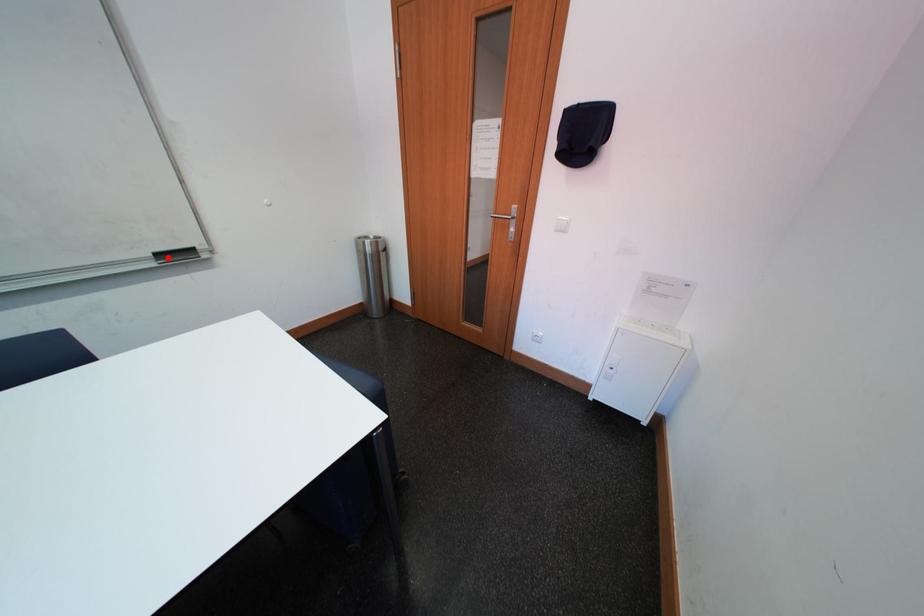
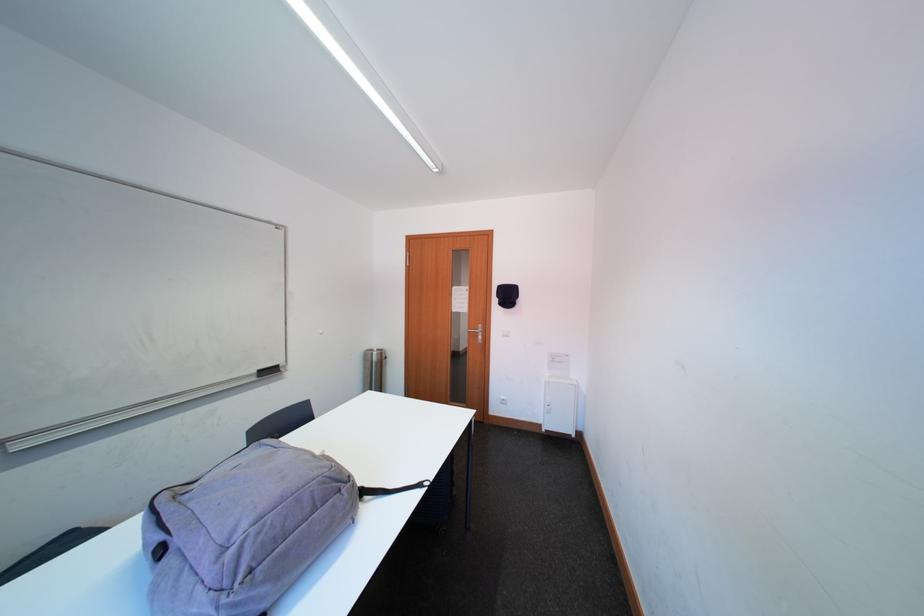
In the second image, find the point that corresponds to the highlighted location in the first image.

(269, 375)